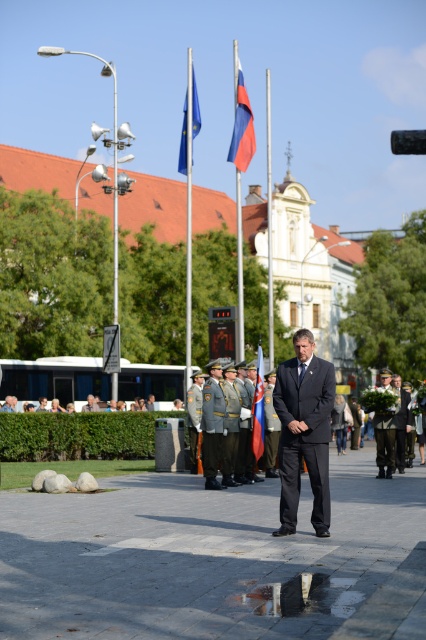
Question: Which point is closer to the camera taking this photo?

Choices:
 (A) (385, 385)
 (B) (244, 157)

Answer: (A)

Question: Can you confirm if blue fabric flag at center is smaller than light brown leather jacket at center?

Choices:
 (A) no
 (B) yes

Answer: (A)

Question: Is dark suit at center behind blue fabric flag at upper center?

Choices:
 (A) yes
 (B) no

Answer: (B)

Question: Observing the image, what is the correct spatial positioning of dark gray uniform at center in reference to blue fabric flag at upper center?

Choices:
 (A) left
 (B) right

Answer: (B)

Question: Which object is the farthest from the red fabric flag at center?

Choices:
 (A) light brown leather jacket at center
 (B) dark suit at center
 (C) gray uniform at center

Answer: (A)

Question: Which of the following is the closest to the observer?

Choices:
 (A) blue fabric flag at center
 (B) gray uniform at center
 (C) red fabric flag at center

Answer: (B)